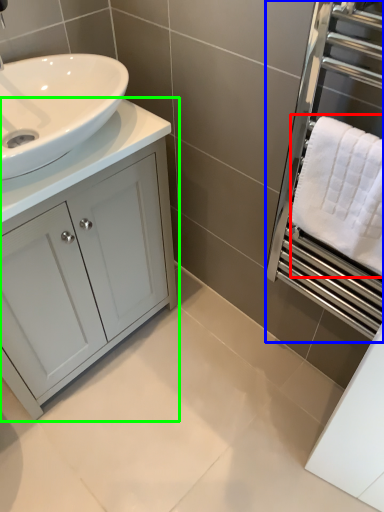
Question: Considering the real-world distances, which object is farthest from bath towel (highlighted by a red box)? screen door (highlighted by a blue box) or bathroom cabinet (highlighted by a green box)?

Choices:
 (A) screen door
 (B) bathroom cabinet

Answer: (B)